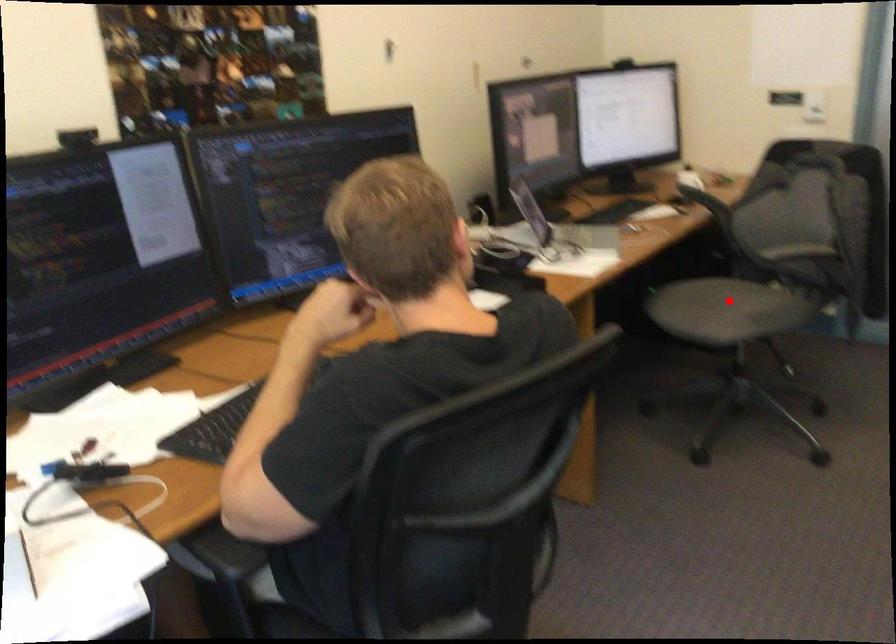
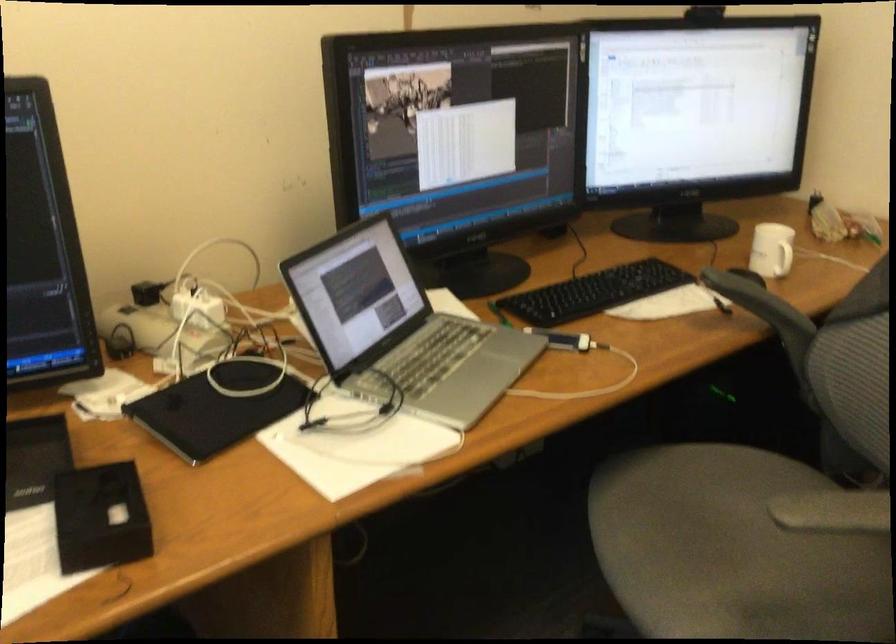
Where in the second image is the point corresponding to the highlighted location from the first image?

(733, 550)